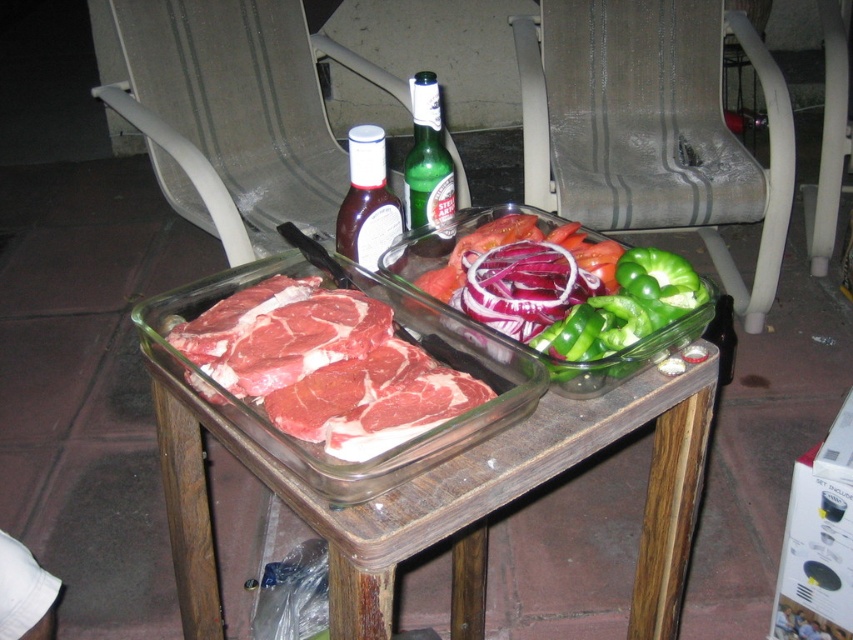
You are planning to stack items on the table for a barbecue. You have a transparent glass tray at center and a green glass bottle at center. Which item should you place at the bottom to prevent it from tipping over?

The transparent glass tray at center is taller than the green glass bottle at center, so placing the taller transparent glass tray at center at the bottom would provide a more stable base to prevent tipping.

You are at a barbecue and want to grab the green glass bottle at center to pour on the green glossy bell pepper at center. Which one should you pick up first?

You should pick up the green glass bottle at center first because the green glossy bell pepper at center is closer to the viewer, so reaching for the bottle behind it would require moving the pepper first.

You are standing at the edge of the patio looking at the table. There is a point at coordinates (428, 464). What object is this point located on?

The point at coordinates (428, 464) is located on the transparent glass tray at center.